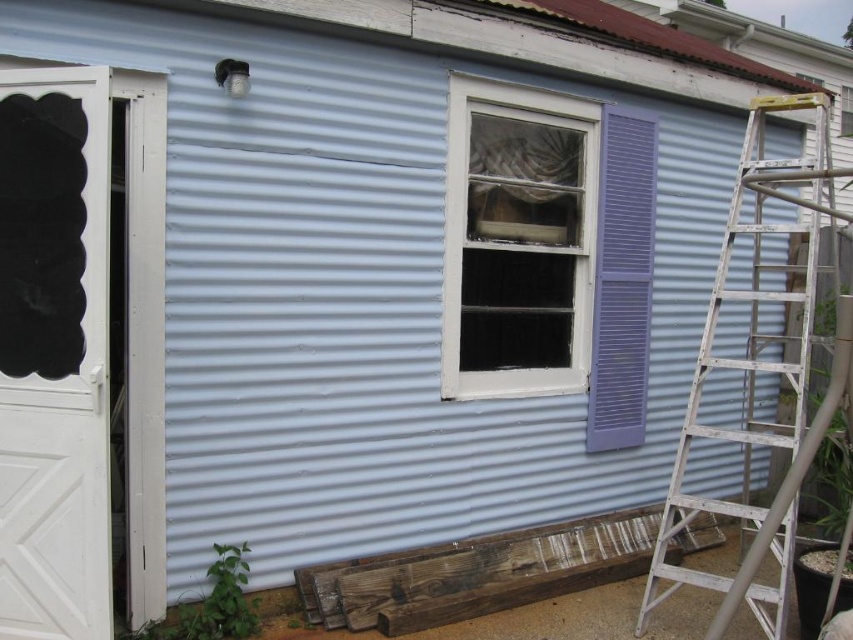
You are standing in front of the house and want to find the entrance. Which object at point (54, 353) is the entrance?

The entrance is the white matte door at left located at point (54, 353).

You are standing in front of the house and want to enter through the white wood window at center. However, you notice the white aluminum ladder at right is blocking your path. Can you walk around the ladder to reach the window?

The white wood window at center is further to the viewer than the white aluminum ladder at right, so the ladder is closer to you. You can walk around the ladder to reach the window since it is blocking your path but is in front of you.